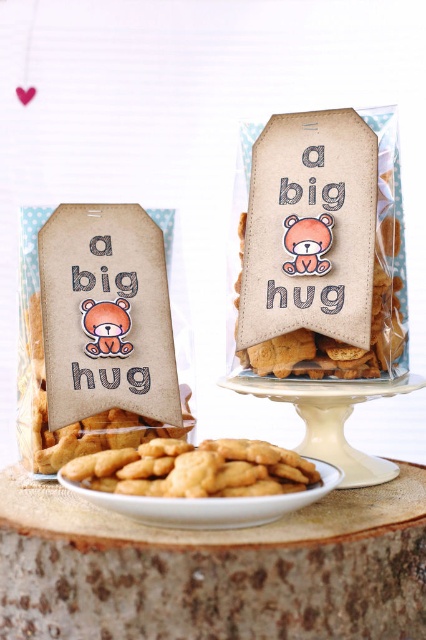
Question: Which point is closer to the camera?

Choices:
 (A) baked brown cookie at left
 (B) brown wood table at center
 (C) matte brown tag at center
 (D) white matte plate at center

Answer: (D)

Question: Can you confirm if brown wood table at center is positioned to the right of baked brown cookie at left?

Choices:
 (A) yes
 (B) no

Answer: (A)

Question: Does matte brown tag at center have a greater width compared to golden crumbly cookies at center?

Choices:
 (A) no
 (B) yes

Answer: (A)

Question: Which point is closer to the camera?

Choices:
 (A) (328, 614)
 (B) (310, 301)

Answer: (A)

Question: Which of the following is the closest to the observer?

Choices:
 (A) (37, 448)
 (B) (360, 541)
 (C) (117, 512)
 (D) (331, 276)

Answer: (B)

Question: Does brown wood table at center lie behind white matte plate at center?

Choices:
 (A) yes
 (B) no

Answer: (A)